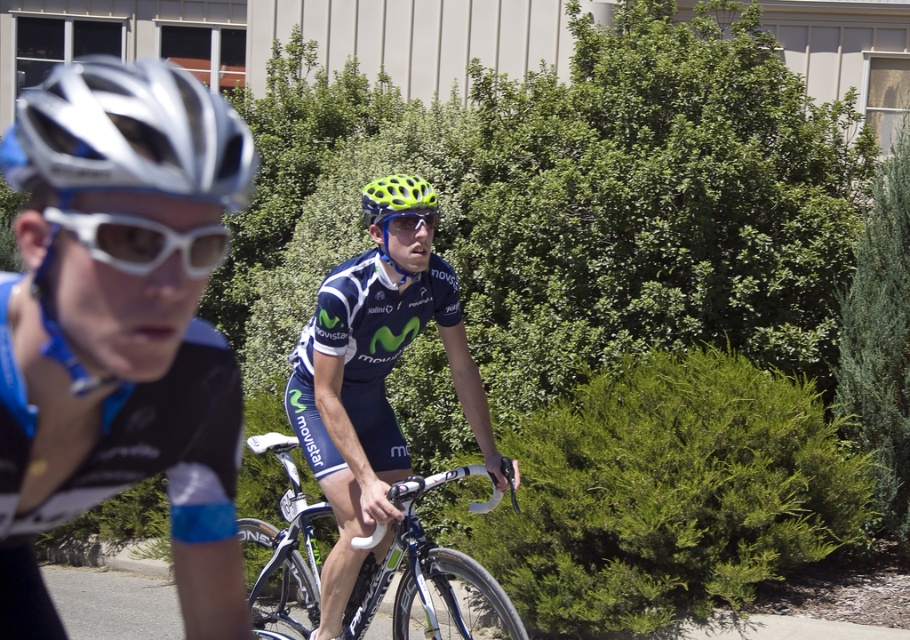
Between white matte/glossy goggles at left and neon yellow mesh bicycle helmet at center, which one is positioned higher?

neon yellow mesh bicycle helmet at center

Can you confirm if white matte/glossy goggles at left is taller than neon yellow mesh bicycle helmet at center?

No.

Which is in front, point (160, 236) or point (368, 196)?

Point (160, 236)

You are a GUI agent. You are given a task and a screenshot of the screen. Output one action in this format:
    pyautogui.click(x=<x>, y=<y>)
    Task: Click on the white matte/glossy goggles at left
    This screenshot has height=640, width=910.
    Given the screenshot: What is the action you would take?
    pyautogui.click(x=143, y=241)

Does matte blue cycling jersey at center appear over neon green matte helmet at center?

Actually, matte blue cycling jersey at center is below neon green matte helmet at center.

Is matte blue cycling jersey at center smaller than neon green matte helmet at center?

Actually, matte blue cycling jersey at center might be larger than neon green matte helmet at center.

Is point (339, 408) behind point (381, 179)?

That is False.

Find the location of a particular element. The width and height of the screenshot is (910, 640). matte blue cycling jersey at center is located at coordinates (372, 392).

Who is higher up, silver metallic helmet at left or silver/matte bicycle helmet at upper left?

silver/matte bicycle helmet at upper left is above.

This screenshot has height=640, width=910. I want to click on silver metallic helmet at left, so click(128, 134).

Is point (76, 381) more distant than point (86, 131)?

Yes, it is.

Identify the location of silver metallic helmet at left. (128, 134).